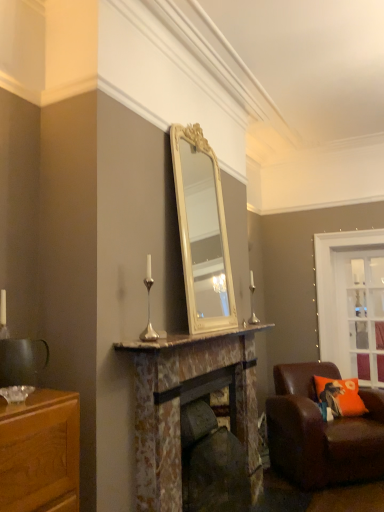
Question: Considering the relative positions of clear glass door at upper right and marble mantel at center in the image provided, is clear glass door at upper right in front of marble mantel at center?

Choices:
 (A) no
 (B) yes

Answer: (A)

Question: Would you say clear glass door at upper right is a long distance from marble mantel at center?

Choices:
 (A) yes
 (B) no

Answer: (A)

Question: Is clear glass door at upper right next to marble mantel at center?

Choices:
 (A) no
 (B) yes

Answer: (A)

Question: From the image's perspective, is clear glass door at upper right over marble mantel at center?

Choices:
 (A) yes
 (B) no

Answer: (B)

Question: Is clear glass door at upper right bigger than marble mantel at center?

Choices:
 (A) yes
 (B) no

Answer: (A)

Question: From their relative heights in the image, would you say rustic stone fireplace at center, the second fireplace in the front-to-back sequence, is taller or shorter than marble mantel at center?

Choices:
 (A) short
 (B) tall

Answer: (B)

Question: Is point (236, 437) closer or farther from the camera than point (268, 325)?

Choices:
 (A) closer
 (B) farther

Answer: (A)

Question: Is rustic stone fireplace at center, the second fireplace in the front-to-back sequence, situated inside marble mantel at center or outside?

Choices:
 (A) outside
 (B) inside

Answer: (A)

Question: In the image, is rustic stone fireplace at center, the second fireplace in the front-to-back sequence, on the left side or the right side of marble mantel at center?

Choices:
 (A) right
 (B) left

Answer: (B)

Question: Considering the positions of marble mantel at center and orange fabric pillow at lower right in the image, is marble mantel at center bigger or smaller than orange fabric pillow at lower right?

Choices:
 (A) small
 (B) big

Answer: (A)

Question: Visually, is marble mantel at center positioned to the left or to the right of orange fabric pillow at lower right?

Choices:
 (A) right
 (B) left

Answer: (B)

Question: Is marble mantel at center situated inside orange fabric pillow at lower right or outside?

Choices:
 (A) inside
 (B) outside

Answer: (B)

Question: Considering the positions of point tap(253, 326) and point tap(350, 394), is point tap(253, 326) closer or farther from the camera than point tap(350, 394)?

Choices:
 (A) closer
 (B) farther

Answer: (A)

Question: From their relative heights in the image, would you say marble mantel at center is taller or shorter than silver metallic candle holder at right, positioned as the 1th candle holder in right-to-left order?

Choices:
 (A) short
 (B) tall

Answer: (A)

Question: Considering their positions, is marble mantel at center located in front of or behind silver metallic candle holder at right, positioned as the 1th candle holder in right-to-left order?

Choices:
 (A) behind
 (B) front

Answer: (B)